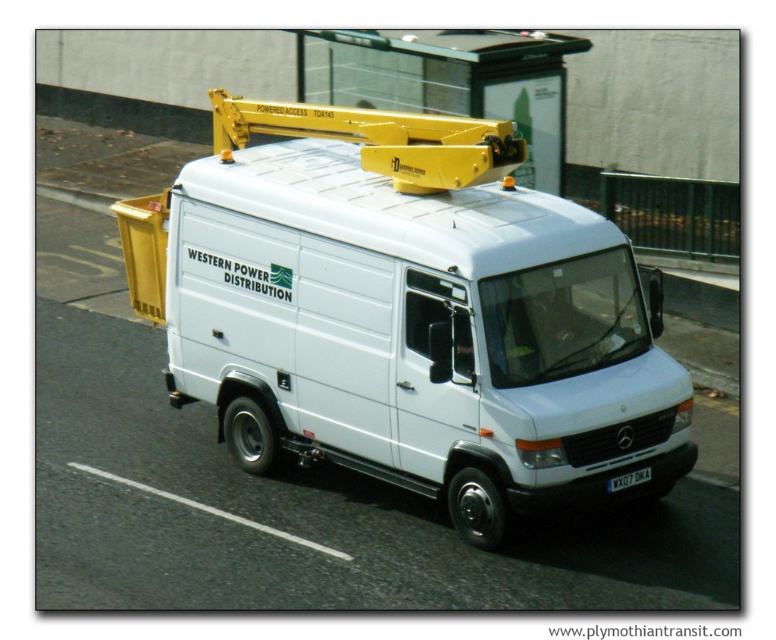
Does white matte van at center have a smaller size compared to black plastic license plate at center?

No, white matte van at center is not smaller than black plastic license plate at center.

Does white matte van at center have a lesser height compared to black plastic license plate at center?

Incorrect, white matte van at center's height does not fall short of black plastic license plate at center's.

Image resolution: width=776 pixels, height=640 pixels. What do you see at coordinates (409, 332) in the screenshot?
I see `white matte van at center` at bounding box center [409, 332].

I want to click on white matte van at center, so click(409, 332).